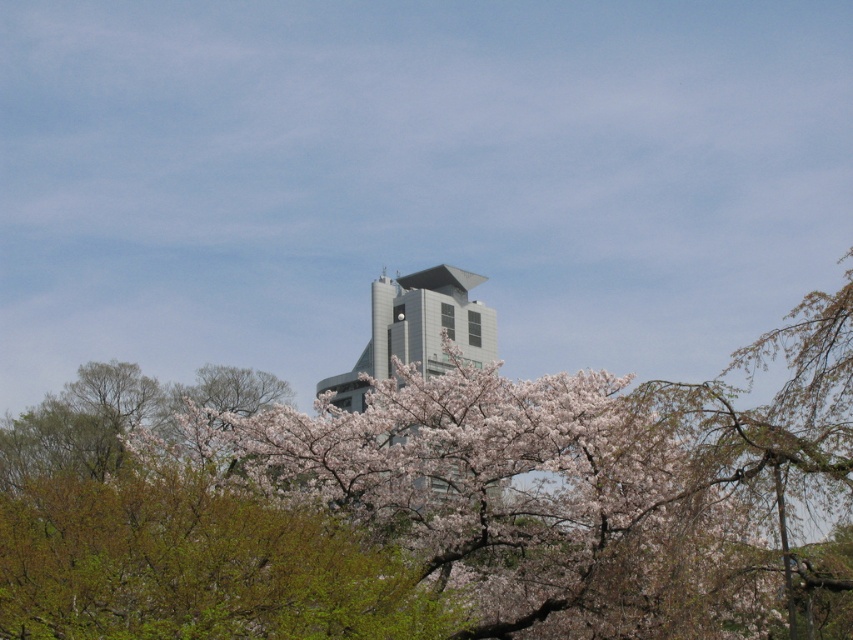
Consider the image. You are standing in the outdoor scene and want to take a photo of the gray metallic building at center without the pink blossoms at center in the frame. Which direction should you move to ensure the building is centered and the blossoms are out of view?

Move to the right so that the gray metallic building at center is centered and the pink blossoms at center, which are to the left of the building, are no longer in the frame.

You are standing at the camera position and want to reach the point marked as point (430,472). If your walking speed is 1.5 meters per second, how many seconds will it take you to reach that point?

The point (430,472) is 47.36 meters from the camera. At a speed of 1.5 meters per second, it would take approximately 31.57 seconds to reach it.

You are standing at the edge of the scene and want to take a photo of both the pink blossoms at center and the gray metallic building at center. How far apart are these two objects from each other?

The pink blossoms at center and the gray metallic building at center are 21.60 meters apart from each other.